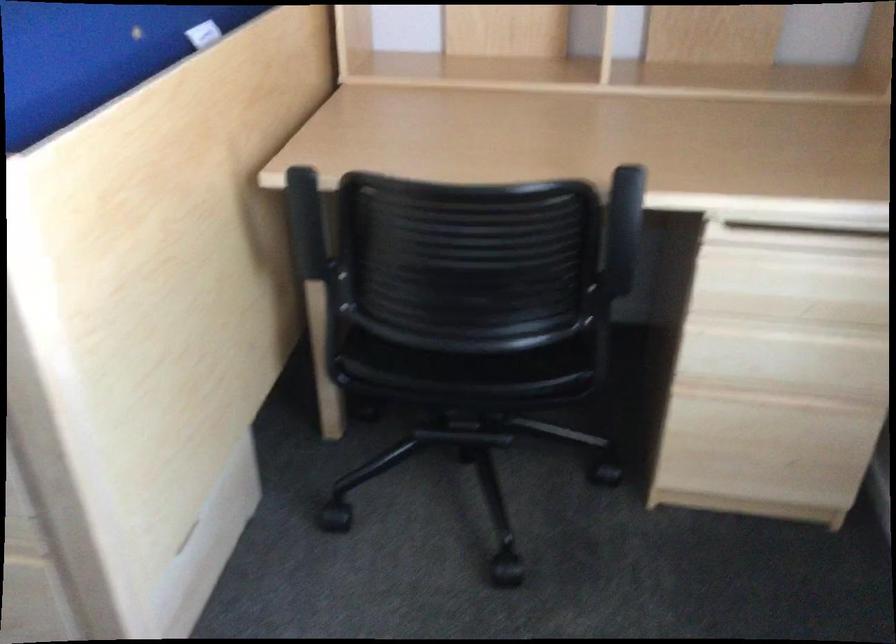
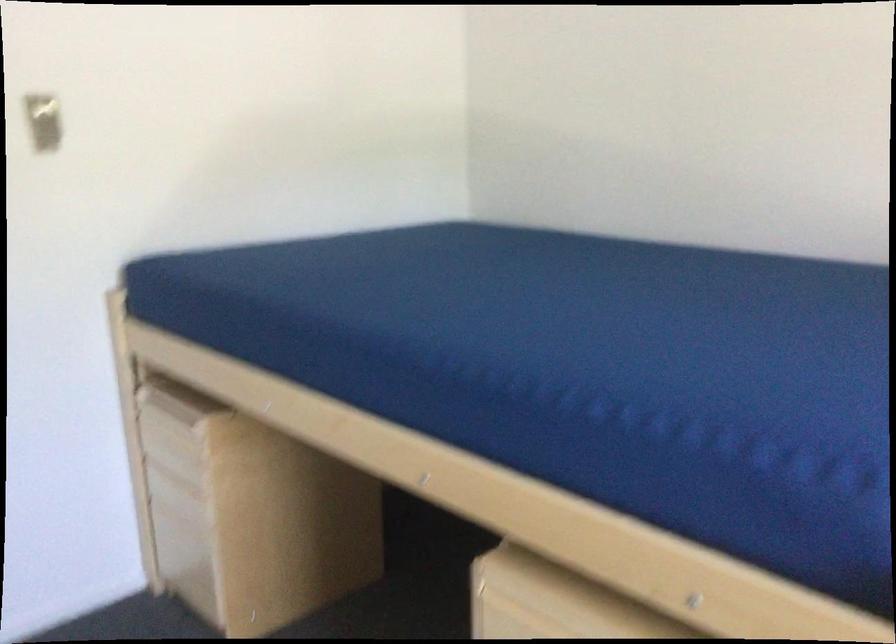
Question: The first image is from the beginning of the video and the second image is from the end. How did the camera likely rotate when shooting the video?

Choices:
 (A) Left
 (B) Right
 (C) Up
 (D) Down

Answer: (A)